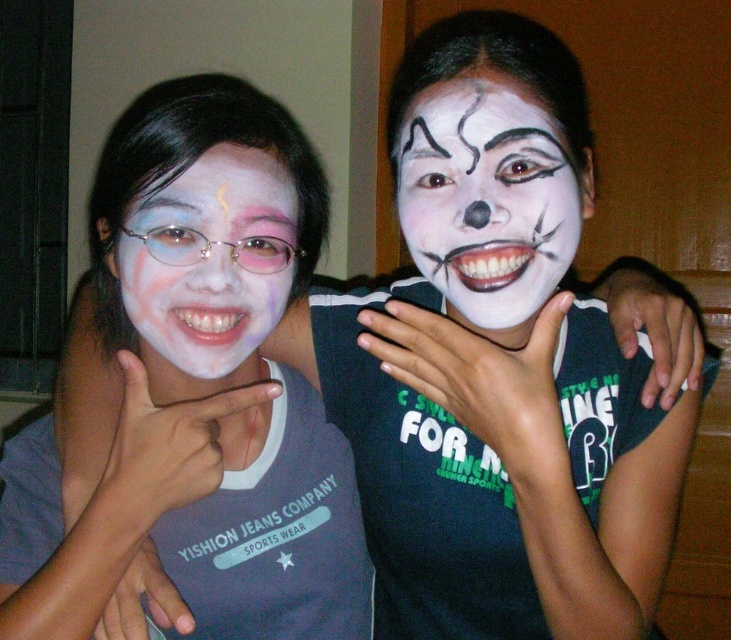
Between white matte face paint at center and matte white face at left, which one has more height?

With more height is white matte face paint at center.

Is point (569, 250) closer to viewer compared to point (155, 300)?

No.

This screenshot has height=640, width=731. Identify the location of white matte face paint at center. pyautogui.click(x=488, y=196).